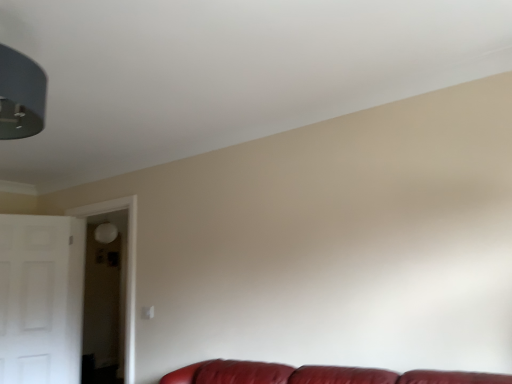
What do you see at coordinates (41, 298) in the screenshot? I see `white matte door at left` at bounding box center [41, 298].

Find the location of a particular element. This screenshot has height=384, width=512. white matte door at left is located at coordinates (41, 298).

Locate an element on the screen. The height and width of the screenshot is (384, 512). white matte door at left is located at coordinates (41, 298).